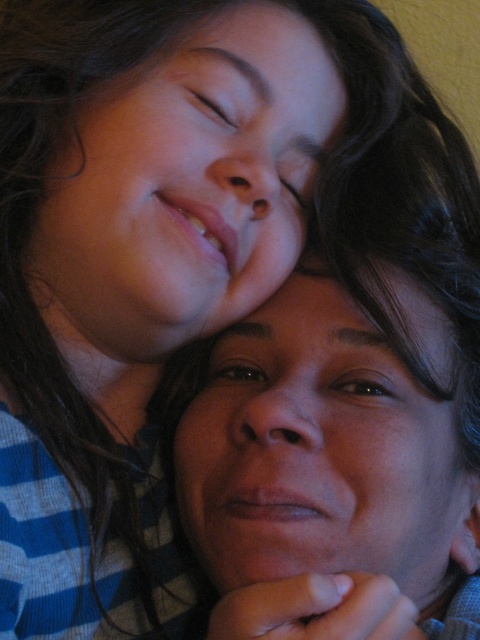
In the scene shown: Does smooth skin face at upper center have a greater height compared to smooth skin face at center?

Yes, smooth skin face at upper center is taller than smooth skin face at center.

Between point (231, 157) and point (298, 560), which one is positioned in front?

Point (298, 560)

Between point (259, 99) and point (374, 442), which one is positioned in front?

Point (374, 442)

I want to click on smooth skin face at upper center, so click(x=184, y=186).